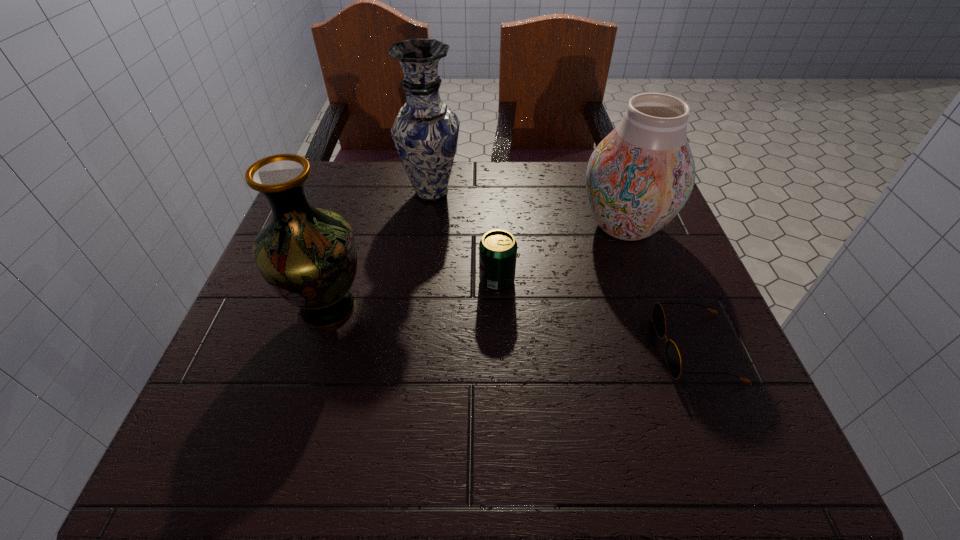
Identify the location of free location at the right edge of the desktop. (615, 249).

Image resolution: width=960 pixels, height=540 pixels. In the image, there is a desktop. In order to click on vacant space at the near left corner in this screenshot , I will do `click(222, 454)`.

The image size is (960, 540). I want to click on free space at the near right corner, so click(767, 444).

This screenshot has height=540, width=960. I want to click on vacant area that lies between the rightmost vase and the fourth tallest object, so click(x=561, y=253).

What are the coordinates of `vacant area that lies between the second vase from right to left and the third object from left to right` in the screenshot? It's located at tap(465, 237).

Identify the location of vacant space in between the shortest object and the rightmost vase. (660, 287).

Image resolution: width=960 pixels, height=540 pixels. Identify the location of free spot between the shortest object and the beer can. (596, 314).

Locate an element on the screen. Image resolution: width=960 pixels, height=540 pixels. vacant space in between the second vase from left to right and the sunglasses is located at coordinates (564, 271).

Where is `vacant area that lies between the beer can and the rightmost vase`? Image resolution: width=960 pixels, height=540 pixels. vacant area that lies between the beer can and the rightmost vase is located at coordinates (561, 253).

Locate an element on the screen. The width and height of the screenshot is (960, 540). vacant area between the rightmost vase and the third object from left to right is located at coordinates (561, 253).